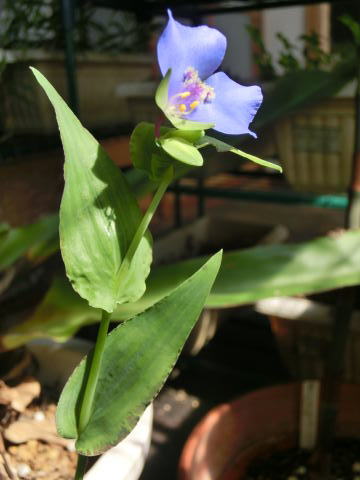
The image size is (360, 480). I want to click on square planter, so click(319, 153).